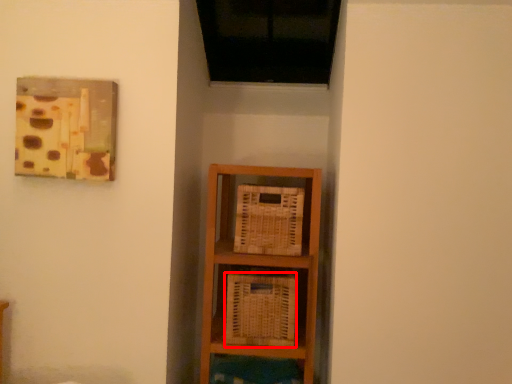
Question: From the image's perspective, where is basket (annotated by the red box) located in relation to basket in the image?

Choices:
 (A) below
 (B) above

Answer: (A)